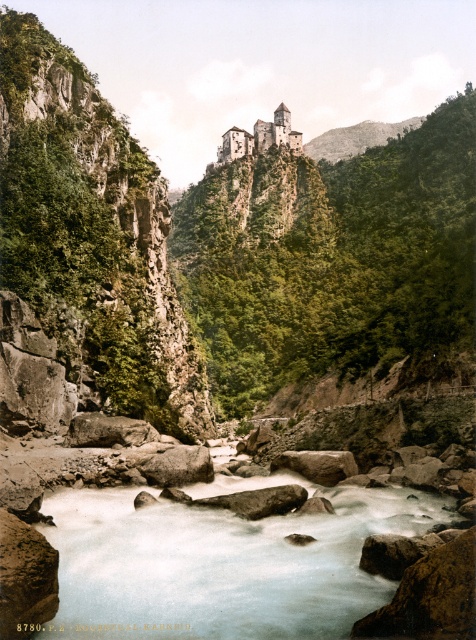
Between smooth rock river at center and brown stone castle at upper center, which one has less height?

smooth rock river at center

Can you confirm if smooth rock river at center is positioned above brown stone castle at upper center?

Actually, smooth rock river at center is below brown stone castle at upper center.

Does point (337, 554) come closer to viewer compared to point (263, 145)?

Yes.

You are a GUI agent. You are given a task and a screenshot of the screen. Output one action in this format:
    pyautogui.click(x=<x>, y=<y>)
    Task: Click on the smooth rock river at center
    This screenshot has width=476, height=640.
    Given the screenshot: What is the action you would take?
    pyautogui.click(x=221, y=561)

Between point (327, 634) and point (364, 129), which one is positioned behind?

Point (364, 129)

Is smooth rock river at center below green rocky mountain at upper center?

Yes.

Describe the element at coordinates (221, 561) in the screenshot. I see `smooth rock river at center` at that location.

I want to click on smooth rock river at center, so click(x=221, y=561).

Between green rocky mountain at upper center and brown stone castle at upper center, which one is positioned lower?

→ Positioned lower is brown stone castle at upper center.

Consider the image. Between green rocky mountain at upper center and brown stone castle at upper center, which one has less height?

With less height is brown stone castle at upper center.

Where is `green rocky mountain at upper center`? This screenshot has height=640, width=476. green rocky mountain at upper center is located at coordinates (356, 138).